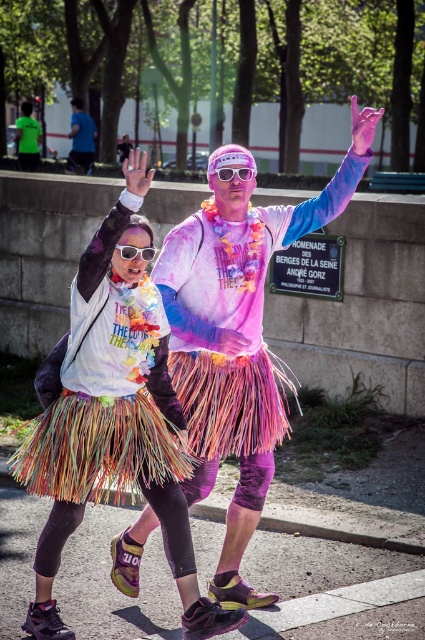
Question: Can you confirm if blue t-shirt at upper left is thinner than clear plastic goggles at upper center?

Choices:
 (A) yes
 (B) no

Answer: (B)

Question: Which object is the closest to the rainbow grass skirt at center?

Choices:
 (A) clear plastic goggles at upper center
 (B) blue t-shirt at upper left
 (C) pink plastic goggles at center
 (D) matte green t-shirt at upper left

Answer: (A)

Question: Observing the image, what is the correct spatial positioning of multicolored tie-dye shirt at center in reference to pink plastic goggles at center?

Choices:
 (A) below
 (B) above

Answer: (A)

Question: Is rainbow grass skirt at center bigger than clear plastic goggles at upper center?

Choices:
 (A) no
 (B) yes

Answer: (B)

Question: Among these objects, which one is farthest from the camera?

Choices:
 (A) pink plastic goggles at center
 (B) blue t-shirt at upper left
 (C) matte green t-shirt at upper left

Answer: (C)

Question: Among these points, which one is farthest from the camera?

Choices:
 (A) (248, 163)
 (B) (186, 592)
 (C) (31, 145)
 (D) (125, 252)

Answer: (C)